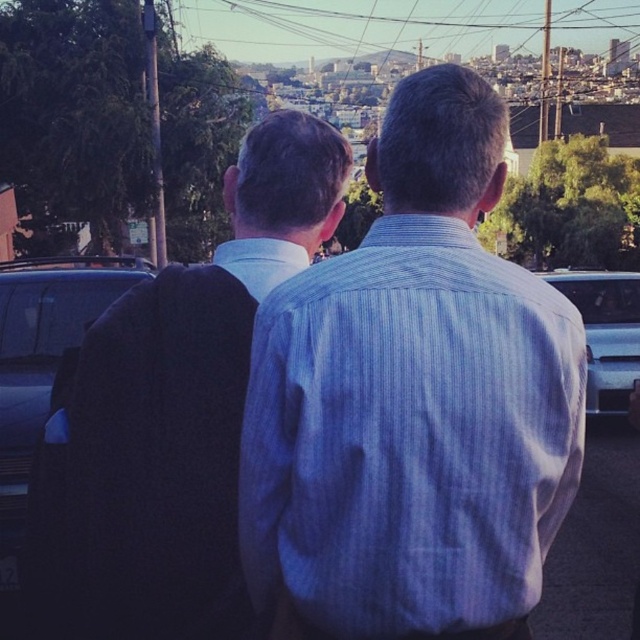
Who is shorter, shiny black car at left or satin silver car at right?

Standing shorter between the two is shiny black car at left.

Can you confirm if shiny black car at left is bigger than satin silver car at right?

Correct, shiny black car at left is larger in size than satin silver car at right.

This screenshot has height=640, width=640. I want to click on shiny black car at left, so click(x=44, y=348).

Who is more distant from viewer, (x=436, y=250) or (x=630, y=353)?

Point (x=630, y=353)

The image size is (640, 640). I want to click on blue striped shirt at center, so click(413, 401).

Locate an element on the screen. Image resolution: width=640 pixels, height=640 pixels. blue striped shirt at center is located at coordinates (413, 401).

Which is more to the left, blue striped shirt at center or shiny black car at left?

shiny black car at left

In the scene shown: Is blue striped shirt at center to the right of shiny black car at left from the viewer's perspective?

Indeed, blue striped shirt at center is positioned on the right side of shiny black car at left.

Image resolution: width=640 pixels, height=640 pixels. Identify the location of blue striped shirt at center. (413, 401).